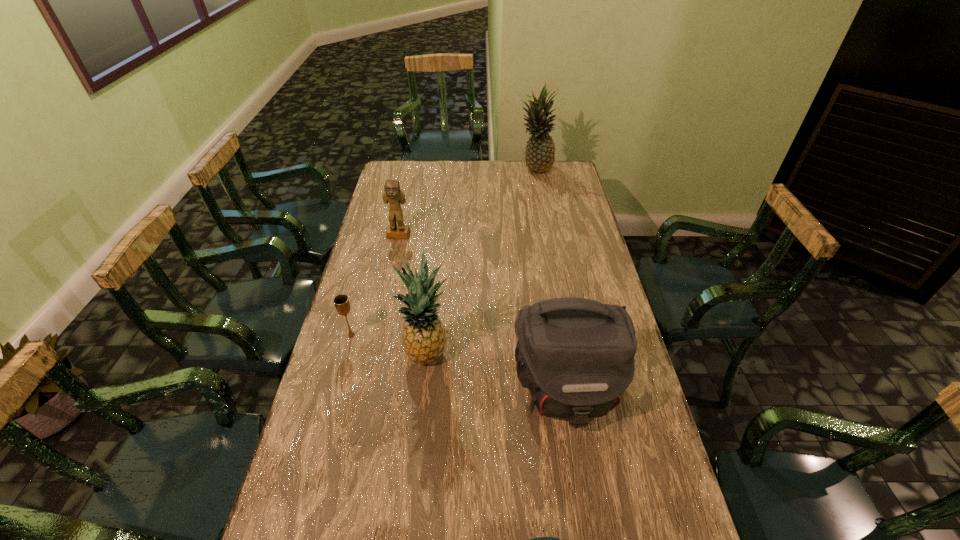
At what (x,y) coordinates should I click in order to perform the action: click on vacant space at the far edge of the desktop. Please return your answer as a coordinate pair (x, y). The width and height of the screenshot is (960, 540). Looking at the image, I should click on 498,186.

Where is `vacant area at the left edge of the desktop`? vacant area at the left edge of the desktop is located at coordinates (315, 468).

Find the location of a particular element. free space at the right edge of the desktop is located at coordinates (593, 259).

Find the location of a particular element. The height and width of the screenshot is (540, 960). vacant area between the right pineapple and the fifth object from right to left is located at coordinates (467, 202).

What are the coordinates of `vacant space that is in between the shoulder bag and the farthest object` in the screenshot? It's located at (550, 280).

Locate an element on the screen. The width and height of the screenshot is (960, 540). empty location between the fourth object from right to left and the leftmost object is located at coordinates (390, 345).

At what (x,y) coordinates should I click in order to perform the action: click on vacant space that is in between the shoulder bag and the right pineapple. Please return your answer as a coordinate pair (x, y). This screenshot has width=960, height=540. Looking at the image, I should click on click(550, 280).

This screenshot has height=540, width=960. In order to click on free space between the fifth nearest object and the shoulder bag in this screenshot , I will do `click(482, 314)`.

You are a GUI agent. You are given a task and a screenshot of the screen. Output one action in this format:
    pyautogui.click(x=<x>, y=<y>)
    Task: Click on the free space that is in between the chalice and the fifth nearest object
    The height and width of the screenshot is (540, 960).
    Given the screenshot: What is the action you would take?
    pyautogui.click(x=375, y=286)

Identify the location of blank region between the right pineapple and the fourth tallest object. (467, 202).